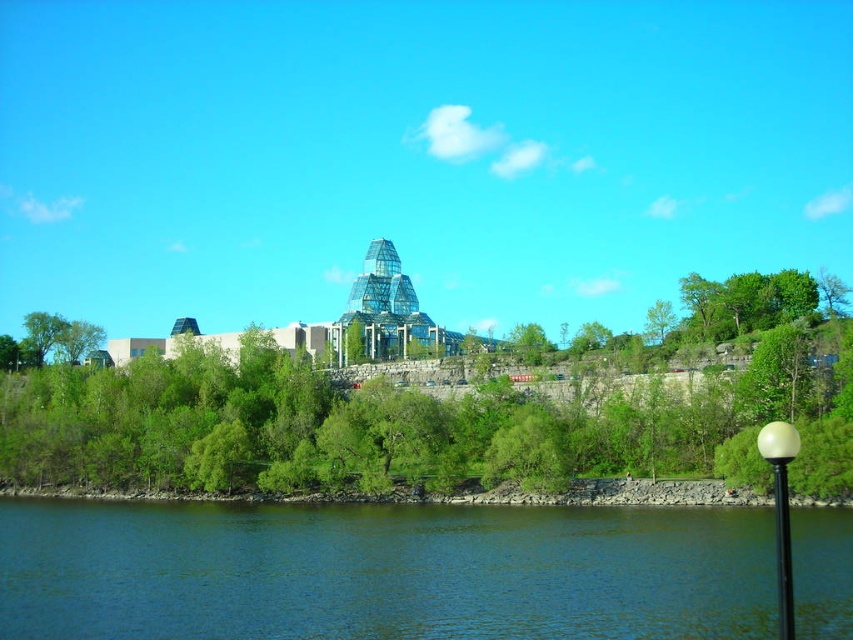
From the picture: You are standing at the point marked by the coordinates point at (433, 416). What object is directly in front of you?

The point at (433, 416) indicates a green leafy tree at center, so the object directly in front of you is the green leafy tree at center.

You are standing on the riverside walkway and want to cross to the other side. The blue water at lower center and the white glossy lamp post at lower right are in your path. Which object is wider, making it harder to navigate around?

The blue water at lower center is wider than the white glossy lamp post at lower right, so it would be harder to navigate around the blue water at lower center.